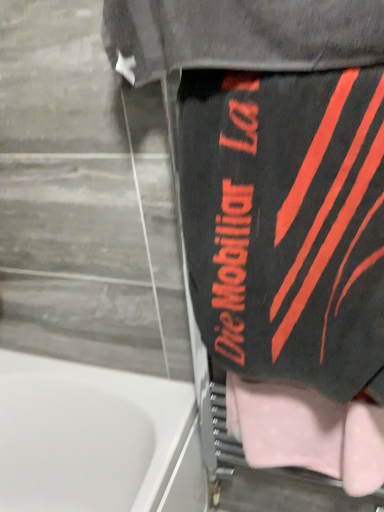
Question: Is pink fabric towel at lower right positioned with its back to black matte towel at right?

Choices:
 (A) yes
 (B) no

Answer: (B)

Question: Does pink fabric towel at lower right come behind black matte towel at right?

Choices:
 (A) no
 (B) yes

Answer: (B)

Question: From a real-world perspective, is pink fabric towel at lower right physically above black matte towel at right?

Choices:
 (A) yes
 (B) no

Answer: (B)

Question: Does pink fabric towel at lower right turn towards black matte towel at right?

Choices:
 (A) no
 (B) yes

Answer: (A)

Question: From a real-world perspective, is pink fabric towel at lower right physically below black matte towel at right?

Choices:
 (A) no
 (B) yes

Answer: (B)

Question: Does pink fabric towel at lower right have a greater height compared to black matte towel at right?

Choices:
 (A) yes
 (B) no

Answer: (B)

Question: Is black matte towel at right wider than pink fabric towel at lower right?

Choices:
 (A) yes
 (B) no

Answer: (A)

Question: Can you confirm if black matte towel at right is positioned to the right of pink fabric towel at lower right?

Choices:
 (A) no
 (B) yes

Answer: (A)

Question: From the image's perspective, would you say black matte towel at right is shown under pink fabric towel at lower right?

Choices:
 (A) yes
 (B) no

Answer: (B)

Question: From the image's perspective, does black matte towel at right appear higher than pink fabric towel at lower right?

Choices:
 (A) yes
 (B) no

Answer: (A)

Question: Can we say black matte towel at right lies outside pink fabric towel at lower right?

Choices:
 (A) no
 (B) yes

Answer: (B)

Question: Is black matte towel at right next to pink fabric towel at lower right and touching it?

Choices:
 (A) no
 (B) yes

Answer: (A)

Question: In the image, is black matte towel at right on the left side or the right side of pink fabric towel at lower right?

Choices:
 (A) right
 (B) left

Answer: (B)